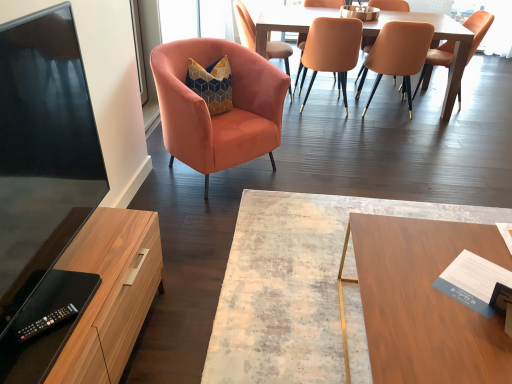
Question: Would you say wooden cabinet at left is a long distance from wooden rectangular table at center?

Choices:
 (A) yes
 (B) no

Answer: (B)

Question: Is wooden cabinet at left not within wooden rectangular table at center?

Choices:
 (A) no
 (B) yes

Answer: (B)

Question: From the image's perspective, is wooden cabinet at left beneath wooden rectangular table at center?

Choices:
 (A) yes
 (B) no

Answer: (A)

Question: Is wooden cabinet at left turned away from wooden rectangular table at center?

Choices:
 (A) no
 (B) yes

Answer: (A)

Question: Considering the relative sizes of wooden cabinet at left and wooden rectangular table at center in the image provided, is wooden cabinet at left wider than wooden rectangular table at center?

Choices:
 (A) no
 (B) yes

Answer: (A)

Question: Looking at their shapes, would you say wooden rectangular table at center is wider or thinner than matte orange chair at center, arranged as the 4th chair when viewed from the left?

Choices:
 (A) wide
 (B) thin

Answer: (A)

Question: Based on their sizes in the image, would you say wooden rectangular table at center is bigger or smaller than matte orange chair at center, placed as the 3th chair when sorted from right to left?

Choices:
 (A) big
 (B) small

Answer: (B)

Question: From the image's perspective, is wooden rectangular table at center above or below matte orange chair at center, placed as the 3th chair when sorted from right to left?

Choices:
 (A) above
 (B) below

Answer: (B)

Question: Is wooden rectangular table at center inside or outside of matte orange chair at center, arranged as the 4th chair when viewed from the left?

Choices:
 (A) inside
 (B) outside

Answer: (B)

Question: Is matte orange chair at upper center, the 4th chair from the right, inside or outside of velvet orange chair at upper left, which is counted as the 5th chair, starting from the right?

Choices:
 (A) outside
 (B) inside

Answer: (A)

Question: Relative to velvet orange chair at upper left, which is counted as the 5th chair, starting from the right, is matte orange chair at upper center, the 4th chair from the right, in front or behind?

Choices:
 (A) behind
 (B) front

Answer: (A)

Question: In terms of height, does matte orange chair at upper center, the 4th chair from the right, look taller or shorter compared to velvet orange chair at upper left, which is counted as the 5th chair, starting from the right?

Choices:
 (A) short
 (B) tall

Answer: (A)

Question: From a real-world perspective, relative to velvet orange chair at upper left, which is counted as the 5th chair, starting from the right, is matte orange chair at upper center, the 4th chair from the right, vertically above or below?

Choices:
 (A) below
 (B) above

Answer: (B)

Question: Is point (282, 52) positioned closer to the camera than point (412, 49)?

Choices:
 (A) farther
 (B) closer

Answer: (A)

Question: Do you think velvet orange chair at upper left, which is counted as the 5th chair, starting from the right, is within matte orange chair at upper center, which appears as the fifth chair when viewed from the left, or outside of it?

Choices:
 (A) inside
 (B) outside

Answer: (B)